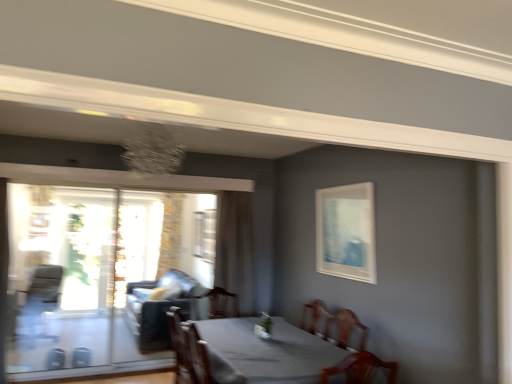
The image size is (512, 384). I want to click on leather armchair at left, placed as the first armchair when sorted from left to right, so click(x=39, y=302).

Describe the element at coordinates (39, 302) in the screenshot. I see `leather armchair at left, placed as the first armchair when sorted from left to right` at that location.

The width and height of the screenshot is (512, 384). Describe the element at coordinates (204, 235) in the screenshot. I see `clear glass window at center, placed as the second window when sorted from left to right` at that location.

Identify the location of suede-like dark gray couch at left. (160, 310).

The height and width of the screenshot is (384, 512). I want to click on dark brown leather armchair at center, which is the 1th armchair in front-to-back order, so click(x=204, y=359).

At what (x,y) coordinates should I click in order to perform the action: click on silky beige curtain at center, which is the second curtain in front-to-back order. Please return your answer as a coordinate pair (x, y). The image size is (512, 384). Looking at the image, I should click on (170, 233).

This screenshot has height=384, width=512. What do you see at coordinates (59, 274) in the screenshot?
I see `transparent glass screen door at left` at bounding box center [59, 274].

The image size is (512, 384). Find the location of `brown sheer curtain at center, the 1th curtain in the right-to-left sequence`. brown sheer curtain at center, the 1th curtain in the right-to-left sequence is located at coordinates (234, 247).

In order to click on curtain on the right of silky beige curtain at center, placed as the first curtain when sorted from left to right in this screenshot , I will do `click(234, 247)`.

Is brown sheer curtain at center, placed as the second curtain when sorted from left to right, far away from silky beige curtain at center, placed as the first curtain when sorted from left to right?

That's right, there is a large distance between brown sheer curtain at center, placed as the second curtain when sorted from left to right, and silky beige curtain at center, placed as the first curtain when sorted from left to right.

Is matte white picture frame at upper right taller or shorter than suede-like dark gray couch at left?

Clearly, matte white picture frame at upper right is shorter compared to suede-like dark gray couch at left.

Is matte white picture frame at upper right facing away from suede-like dark gray couch at left?

No, suede-like dark gray couch at left is not at the back of matte white picture frame at upper right.

Based on the photo, choose the correct answer: Is matte white picture frame at upper right inside suede-like dark gray couch at left or outside it?

matte white picture frame at upper right is spatially situated outside suede-like dark gray couch at left.

From a real-world perspective, is matte white picture frame at upper right beneath suede-like dark gray couch at left?

Actually, matte white picture frame at upper right is physically above suede-like dark gray couch at left in the real world.

From a real-world perspective, which object rests below the other?

silky beige curtain at center, the second curtain positioned from the right, from a real-world perspective.

From the picture: Are clear glass window at center, which is the second window in front-to-back order, and silky beige curtain at center, placed as the first curtain when sorted from left to right, making contact?

There is a gap between clear glass window at center, which is the second window in front-to-back order, and silky beige curtain at center, placed as the first curtain when sorted from left to right.

Is clear glass window at center, marked as the 1th window in a back-to-front arrangement, spatially inside silky beige curtain at center, which is the second curtain in front-to-back order, or outside of it?

clear glass window at center, marked as the 1th window in a back-to-front arrangement, is spatially situated outside silky beige curtain at center, which is the second curtain in front-to-back order.

Where is `curtain to the left of clear glass window at center, placed as the second window when sorted from left to right`? This screenshot has width=512, height=384. curtain to the left of clear glass window at center, placed as the second window when sorted from left to right is located at coordinates [x=170, y=233].

From a real-world perspective, which is physically above, matte white picture frame at upper right or transparent glass screen door at left?

matte white picture frame at upper right, from a real-world perspective.

Which of these two, matte white picture frame at upper right or transparent glass screen door at left, is wider?

With larger width is transparent glass screen door at left.

Visually, is matte white picture frame at upper right positioned to the left or to the right of transparent glass screen door at left?

In the image, matte white picture frame at upper right appears on the right side of transparent glass screen door at left.

Do you think transparent glass window at left, positioned as the first window in front-to-back order, is within leather armchair at left, placed as the first armchair when sorted from left to right, or outside of it?

transparent glass window at left, positioned as the first window in front-to-back order, is located beyond the bounds of leather armchair at left, placed as the first armchair when sorted from left to right.

Considering the sizes of objects transparent glass window at left, positioned as the first window in front-to-back order, and leather armchair at left, which is counted as the 1th armchair, starting from the back, in the image provided, who is thinner, transparent glass window at left, positioned as the first window in front-to-back order, or leather armchair at left, which is counted as the 1th armchair, starting from the back,?

With smaller width is transparent glass window at left, positioned as the first window in front-to-back order.

Could you tell me if transparent glass window at left, the 1th window when ordered from left to right, is facing leather armchair at left, placed as the first armchair when sorted from left to right?

No, transparent glass window at left, the 1th window when ordered from left to right, does not turn towards leather armchair at left, placed as the first armchair when sorted from left to right.

Locate an element on the screen. This screenshot has height=384, width=512. the 1st window to the left of the matte white picture frame at upper right, counting from the anchor's position is located at coordinates (204, 235).

Is clear glass window at center, placed as the second window when sorted from left to right, situated inside matte white picture frame at upper right or outside?

clear glass window at center, placed as the second window when sorted from left to right, is not enclosed by matte white picture frame at upper right.

Are clear glass window at center, the 1th window viewed from the right, and matte white picture frame at upper right beside each other?

They are not placed beside each other.

What's the angular difference between clear glass window at center, marked as the 1th window in a back-to-front arrangement, and matte white picture frame at upper right's facing directions?

The facing directions of clear glass window at center, marked as the 1th window in a back-to-front arrangement, and matte white picture frame at upper right are 0.308 degrees apart.

This screenshot has width=512, height=384. What are the coordinates of `table that is in front of the clear glass window at center, the 1th window viewed from the right` in the screenshot? It's located at (248, 352).

Which is correct: smooth gray table at center is inside clear glass window at center, which is the second window in front-to-back order, or outside of it?

smooth gray table at center is not inside clear glass window at center, which is the second window in front-to-back order, it's outside.

Could you measure the distance between smooth gray table at center and clear glass window at center, placed as the second window when sorted from left to right?

A distance of 2.38 meters exists between smooth gray table at center and clear glass window at center, placed as the second window when sorted from left to right.

In the scene shown: From a real-world perspective, is smooth gray table at center physically located above or below clear glass window at center, which is the second window in front-to-back order?

smooth gray table at center is situated lower than clear glass window at center, which is the second window in front-to-back order, in the real world.

In the image, there is a silky beige curtain at center, which is the second curtain in front-to-back order. At what (x,y) coordinates should I click in order to perform the action: click on curtain above it (from the image's perspective). Please return your answer as a coordinate pair (x, y). Image resolution: width=512 pixels, height=384 pixels. Looking at the image, I should click on (234, 247).

Identify the location of couch that appears below the matte white picture frame at upper right (from the image's perspective). The image size is (512, 384). (160, 310).

Considering their positions, is matte white picture frame at upper right positioned closer to leather armchair at left, positioned as the 2th armchair in front-to-back order, than transparent glass screen door at left?

transparent glass screen door at left is closer to leather armchair at left, positioned as the 2th armchair in front-to-back order.

From the image, which object appears to be farther from dark brown leather armchair at center, the second armchair in the back-to-front sequence, clear glass window at center, the 1th window viewed from the right, or leather armchair at left, which is counted as the 1th armchair, starting from the back?

leather armchair at left, which is counted as the 1th armchair, starting from the back, lies further to dark brown leather armchair at center, the second armchair in the back-to-front sequence, than the other object.

Which object lies nearer to the anchor point brown sheer curtain at center, the first curtain viewed from the front, smooth gray table at center or transparent glass window at left, the 2th window positioned from the right?

smooth gray table at center.

Looking at the image, which one is located closer to clear glass window at center, the 1th window viewed from the right, brown sheer curtain at center, the first curtain viewed from the front, or leather armchair at left, placed as the first armchair when sorted from left to right?

brown sheer curtain at center, the first curtain viewed from the front, is closer to clear glass window at center, the 1th window viewed from the right.

Which object lies nearer to the anchor point matte white picture frame at upper right, transparent glass screen door at left or silky beige curtain at center, placed as the first curtain when sorted from left to right?

silky beige curtain at center, placed as the first curtain when sorted from left to right.

Estimate the real-world distances between objects in this image. Which object is further from transparent glass window at left, the 1th window when ordered from left to right, matte white picture frame at upper right or clear glass window at center, marked as the 1th window in a back-to-front arrangement?

The object further to transparent glass window at left, the 1th window when ordered from left to right, is matte white picture frame at upper right.

Estimate the real-world distances between objects in this image. Which object is further from clear glass window at center, which is the second window in front-to-back order, dark brown leather armchair at center, which appears as the first armchair when viewed from the right, or suede-like dark gray couch at left?

Among the two, dark brown leather armchair at center, which appears as the first armchair when viewed from the right, is located further to clear glass window at center, which is the second window in front-to-back order.

Which object lies further to the anchor point silky beige curtain at center, positioned as the 1th curtain in back-to-front order, smooth gray table at center or transparent glass screen door at left?

Based on the image, smooth gray table at center appears to be further to silky beige curtain at center, positioned as the 1th curtain in back-to-front order.

This screenshot has height=384, width=512. What are the coordinates of `couch between leather armchair at left, placed as the first armchair when sorted from left to right, and clear glass window at center, which is the second window in front-to-back order, from left to right` in the screenshot? It's located at (160, 310).

At what (x,y) coordinates should I click in order to perform the action: click on window between leather armchair at left, arranged as the 2th armchair when viewed from the right, and clear glass window at center, placed as the second window when sorted from left to right, from left to right. Please return your answer as a coordinate pair (x, y). This screenshot has width=512, height=384. Looking at the image, I should click on (97, 263).

Where is `screen door positioned between transparent glass window at left, positioned as the first window in front-to-back order, and leather armchair at left, which is counted as the 1th armchair, starting from the back, from near to far`? screen door positioned between transparent glass window at left, positioned as the first window in front-to-back order, and leather armchair at left, which is counted as the 1th armchair, starting from the back, from near to far is located at coordinates (59, 274).

Locate an element on the screen. The image size is (512, 384). curtain between transparent glass screen door at left and silky beige curtain at center, the second curtain positioned from the right, in the front-back direction is located at coordinates (234, 247).